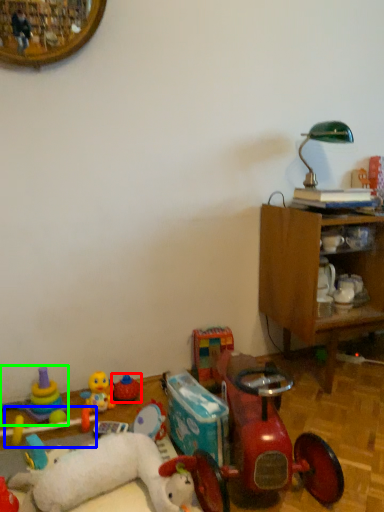
Question: Estimate the real-world distances between objects in this image. Which object is closer to toy (highlighted by a red box), toy (highlighted by a blue box) or toy (highlighted by a green box)?

Choices:
 (A) toy
 (B) toy

Answer: (A)